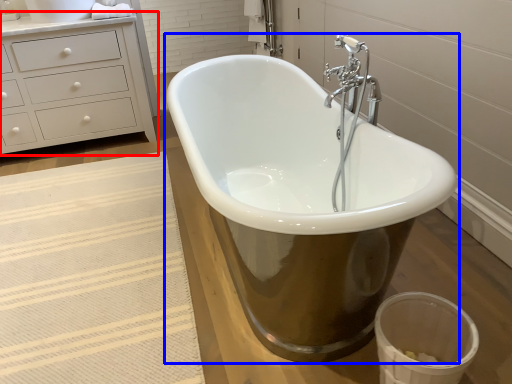
Question: Which object is further to the camera taking this photo, chest of drawers (highlighted by a red box) or bathtub (highlighted by a blue box)?

Choices:
 (A) chest of drawers
 (B) bathtub

Answer: (A)